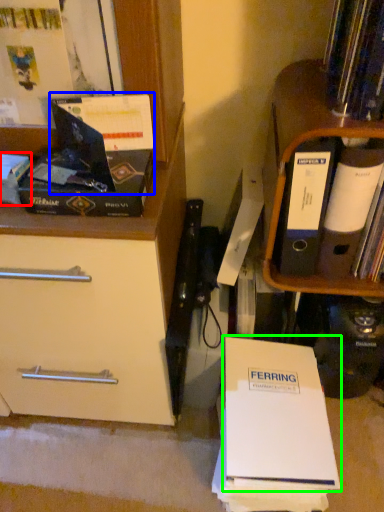
Question: Which is farther away from book (highlighted by a red box)? paperback book (highlighted by a blue box) or paperback book (highlighted by a green box)?

Choices:
 (A) paperback book
 (B) paperback book

Answer: (B)